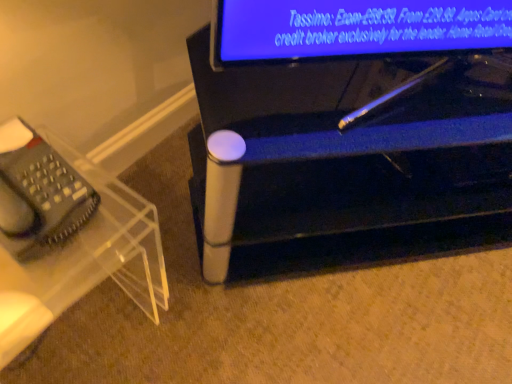
Question: Does point (227, 102) appear closer or farther from the camera than point (106, 273)?

Choices:
 (A) closer
 (B) farther

Answer: (A)

Question: From the image's perspective, relative to transparent acrylic phone stand at left, the 1th furniture in the left-to-right sequence, is metallic silver pen at lower center, the 1th furniture from the right, above or below?

Choices:
 (A) above
 (B) below

Answer: (A)

Question: Which is nearer to the transparent acrylic phone stand at left, the 1th furniture in the left-to-right sequence?

Choices:
 (A) clear plastic telephone at left
 (B) metallic silver pen at lower center, marked as the second furniture in a left-to-right arrangement

Answer: (A)

Question: Estimate the real-world distances between objects in this image. Which object is closer to the clear plastic telephone at left?

Choices:
 (A) metallic silver pen at lower center, marked as the second furniture in a left-to-right arrangement
 (B) transparent acrylic phone stand at left, arranged as the 2th furniture when viewed from the right

Answer: (B)